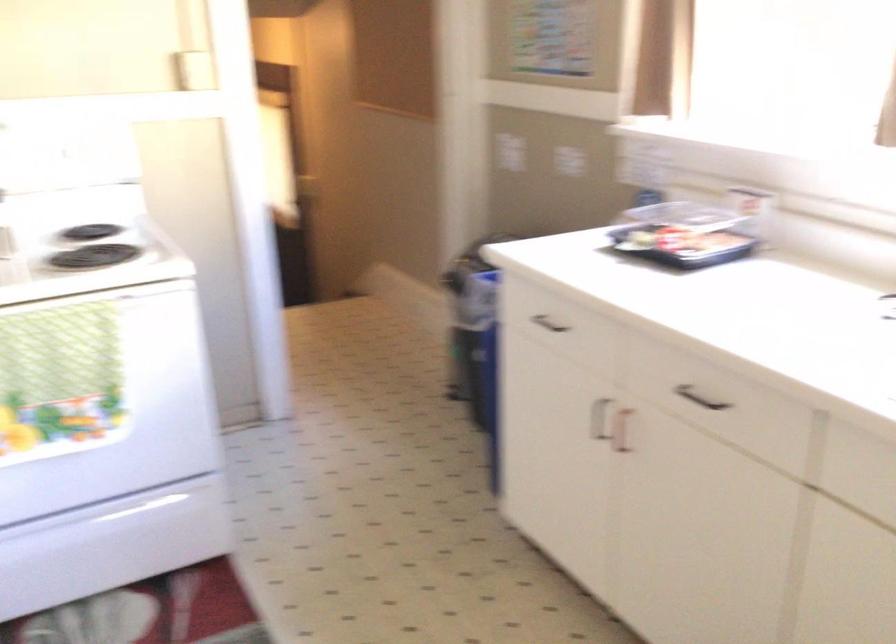
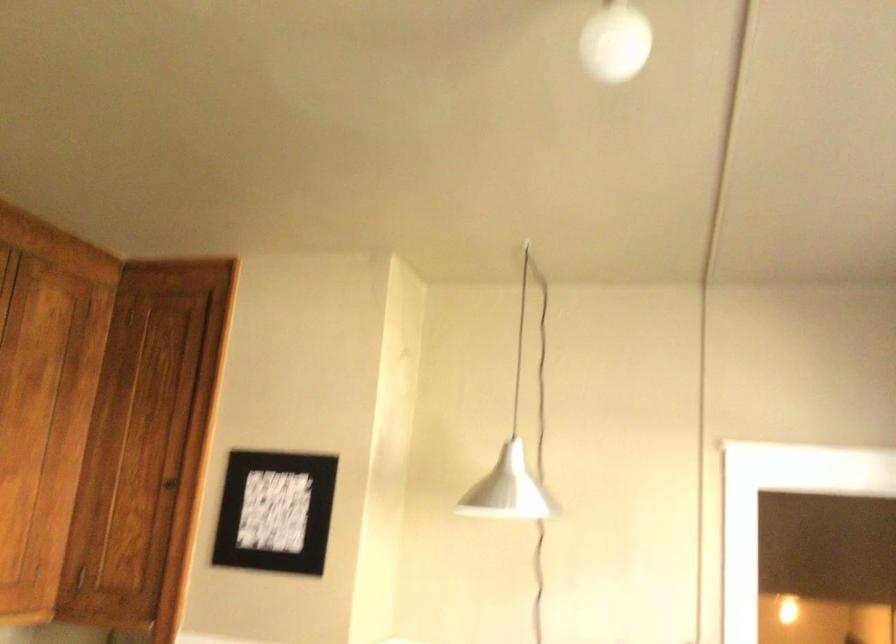
First-person continuous shooting, in which direction is the camera rotating?

The camera's rotation is toward left-up.